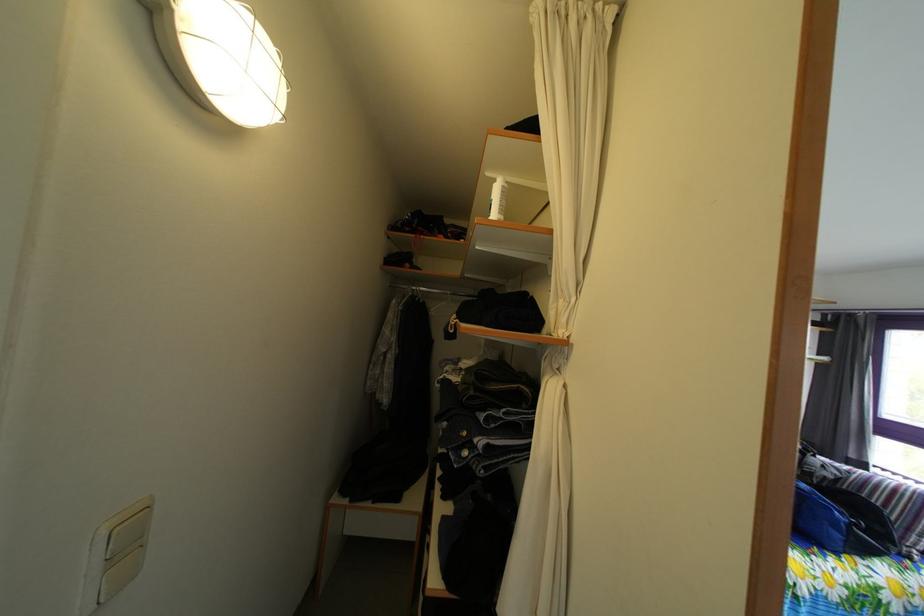
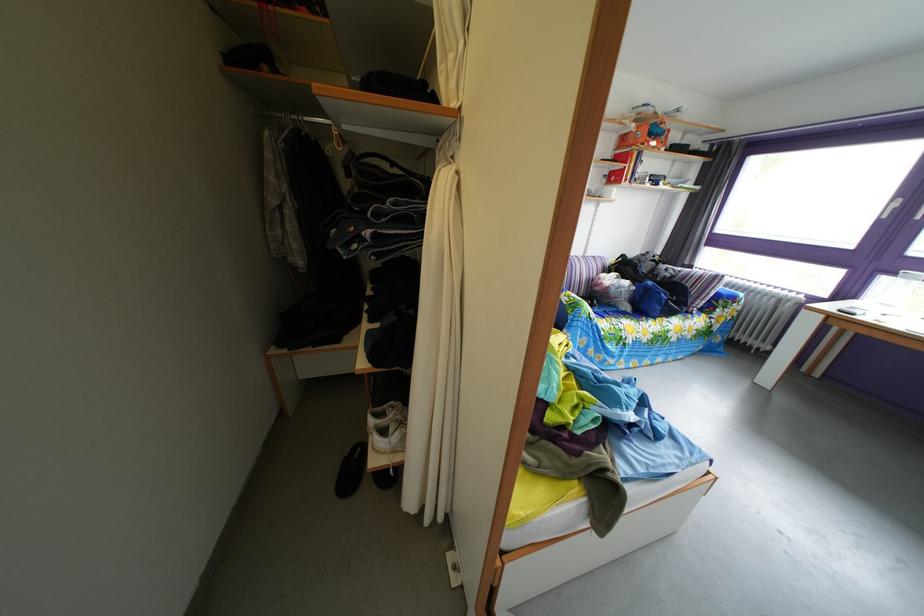
Locate, in the second image, the point that corresponds to point 545,416 in the first image.

(438, 207)